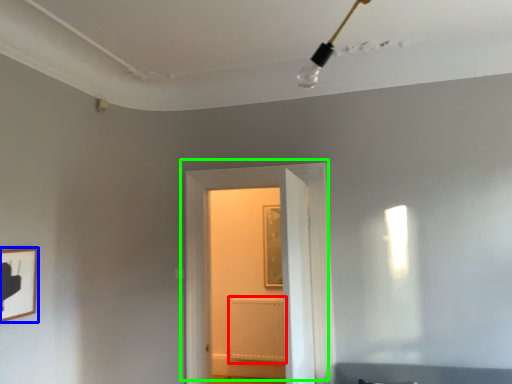
Question: Which object is positioned closest to radiator (highlighted by a red box)? Select from picture frame (highlighted by a blue box) and door (highlighted by a green box).

Choices:
 (A) picture frame
 (B) door

Answer: (B)